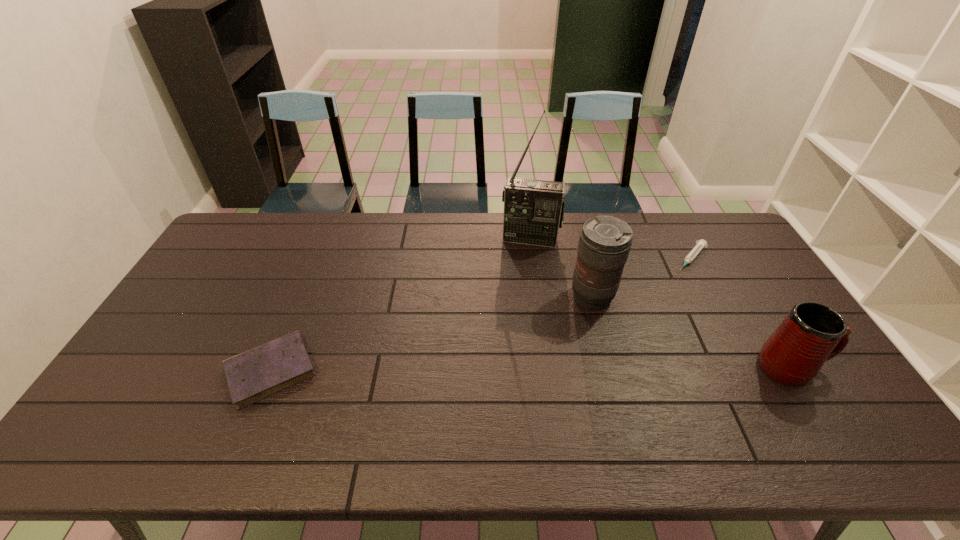
What are the coordinates of `diary` in the screenshot? It's located at (258, 373).

Find the location of `mug`. mug is located at coordinates (812, 333).

You are a GUI agent. You are given a task and a screenshot of the screen. Output one action in this format:
    pyautogui.click(x=<x>, y=<y>)
    Task: Click on the second tallest object
    The image size is (960, 540).
    Given the screenshot: What is the action you would take?
    [x=604, y=244]

Where is `the third farthest object`? This screenshot has width=960, height=540. the third farthest object is located at coordinates (604, 244).

I want to click on syringe, so click(700, 244).

The height and width of the screenshot is (540, 960). Find the location of `the tallest object`. the tallest object is located at coordinates (533, 209).

Locate an element on the screen. blank space located 0.080m on the right of the diary is located at coordinates (348, 370).

Identify the location of vacant space located 0.330m on the side of the second tallest object where the control switches are located. The image size is (960, 540). point(525,387).

At what (x,y) coordinates should I click in order to perform the action: click on free region located 0.300m on the side of the second tallest object where the control switches are located. Please return your answer as a coordinate pair (x, y). Looking at the image, I should click on (532, 379).

Identify the location of free point located 0.380m on the side of the second tallest object where the control switches are located. This screenshot has height=540, width=960. (516, 401).